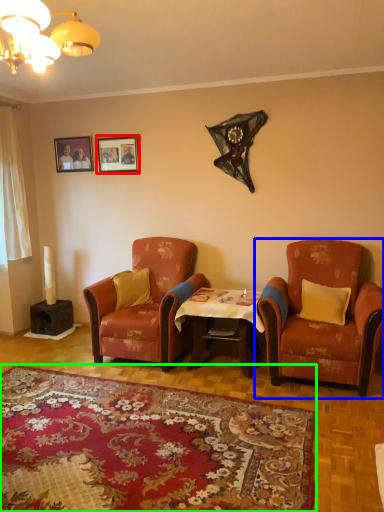
Question: Based on their relative distances, which object is nearer to picture frame (highlighted by a red box)? Choose from chair (highlighted by a blue box) and plain (highlighted by a green box).

Choices:
 (A) chair
 (B) plain

Answer: (A)